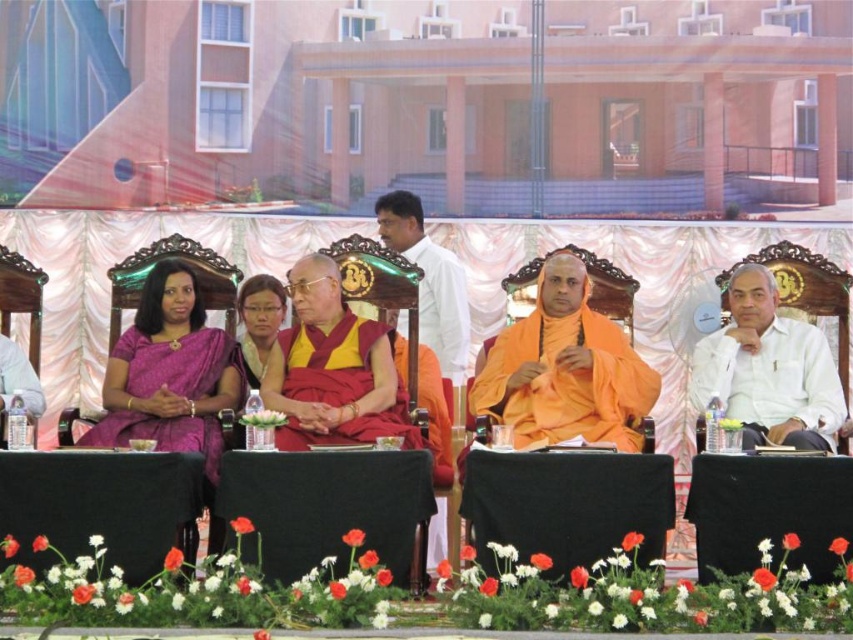
Question: Does orange silk robe at center appear under purple silk saree at center?

Choices:
 (A) no
 (B) yes

Answer: (A)

Question: Is white cotton shirt at right bigger than white silk robe at center?

Choices:
 (A) no
 (B) yes

Answer: (B)

Question: Does white cotton shirt at right appear on the left side of white silk robe at center?

Choices:
 (A) no
 (B) yes

Answer: (A)

Question: Which point is farther to the camera?

Choices:
 (A) (289, 358)
 (B) (97, 428)

Answer: (A)

Question: Which point is farther from the camera taking this photo?

Choices:
 (A) (450, 349)
 (B) (212, 422)
 (C) (749, 273)

Answer: (A)

Question: Which is farther from the purple silk saree at center?

Choices:
 (A) yellow silk robe at center
 (B) white cotton shirt at right

Answer: (B)